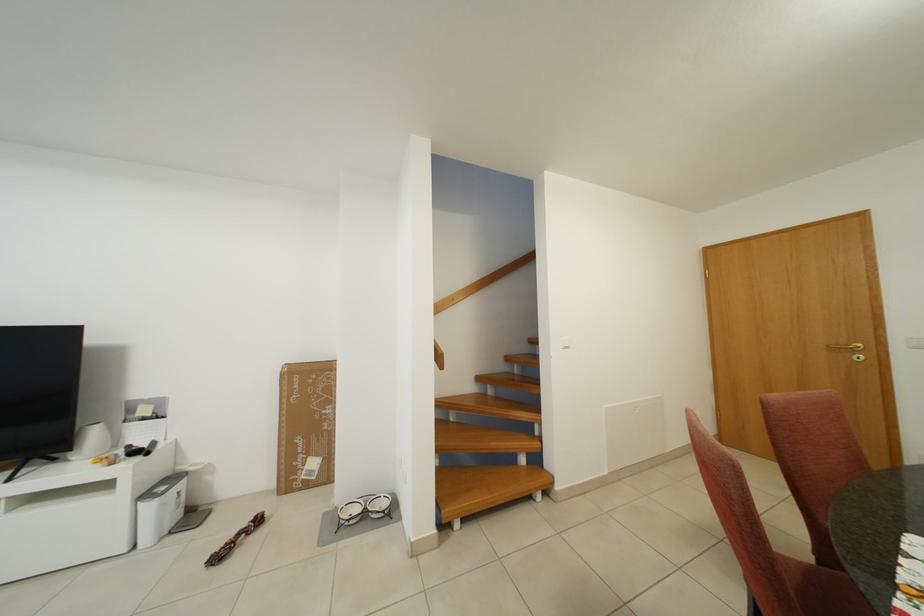
This screenshot has height=616, width=924. What do you see at coordinates (848, 350) in the screenshot?
I see `the gold door handle` at bounding box center [848, 350].